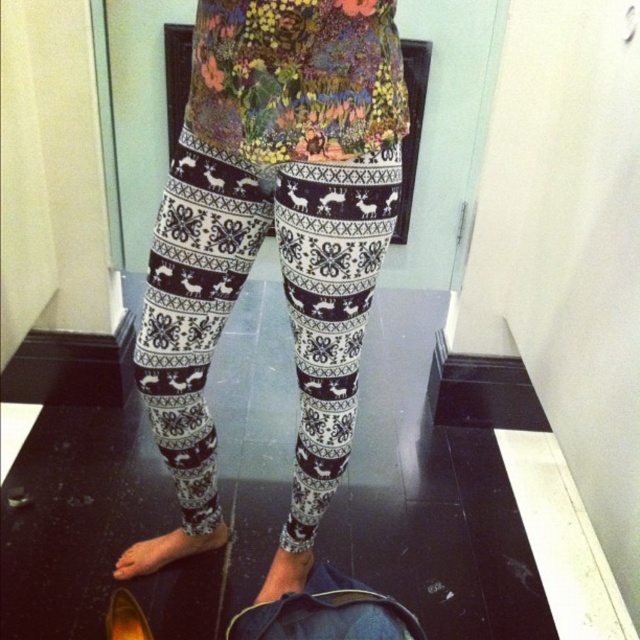
You are designing a virtual fitting room and need to place a 3D model of the white printed leggings at center exactly at the coordinates provided in the scene. What are the coordinates where you should position the leggings?

The white printed leggings at center should be positioned at coordinates point (285, 300).

You are a fashion designer observing the image and need to determine the spatial relationship between the two items. Which object is taller, the white printed leggings at center or the gold metallic shoe at lower left?

The white printed leggings at center is taller than the gold metallic shoe at lower left according to the description.

You are a photographer trying to capture the best shot of the person wearing the patterned leggings. You are standing at point (x=128, y=636) and want to move closer to the subject. Which direction should you move to get a better angle without moving past point (x=336, y=312)?

Since point (x=336, y=312) is in front of point (x=128, y=636), you should move forward towards point (x=336, y=312) to get a better angle without passing it.